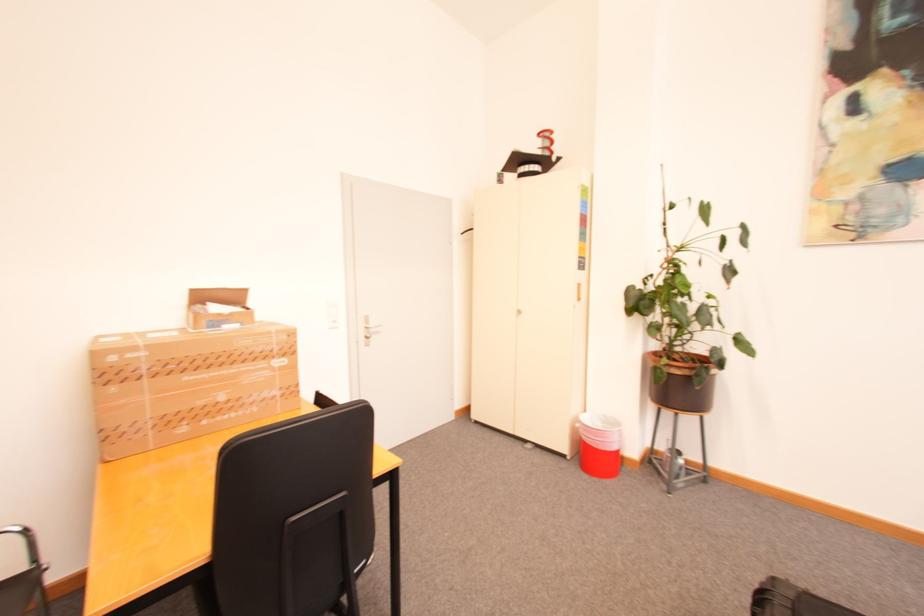
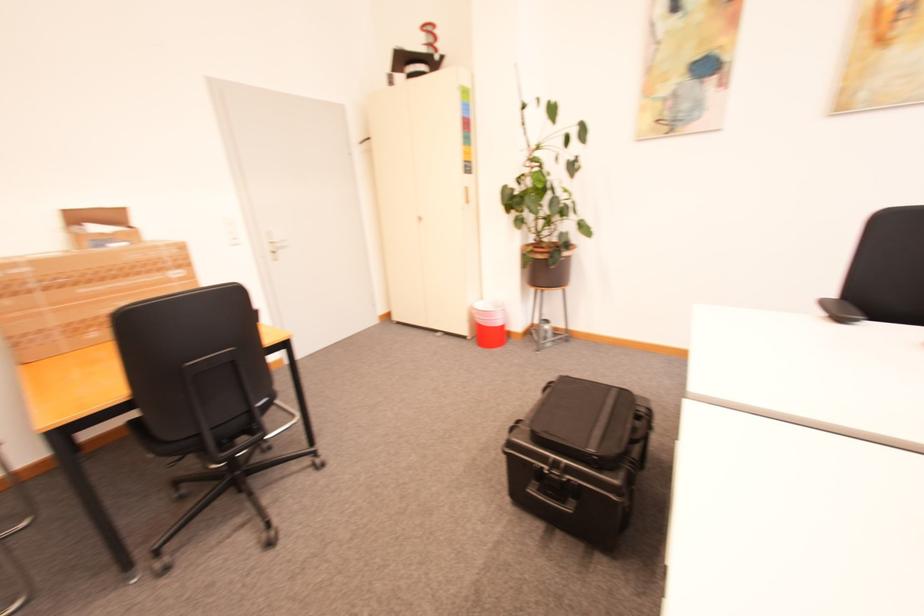
Question: The images are taken continuously from a first-person perspective. In which direction is your viewpoint rotating?

Choices:
 (A) Left
 (B) Right
 (C) Up
 (D) Down

Answer: (D)